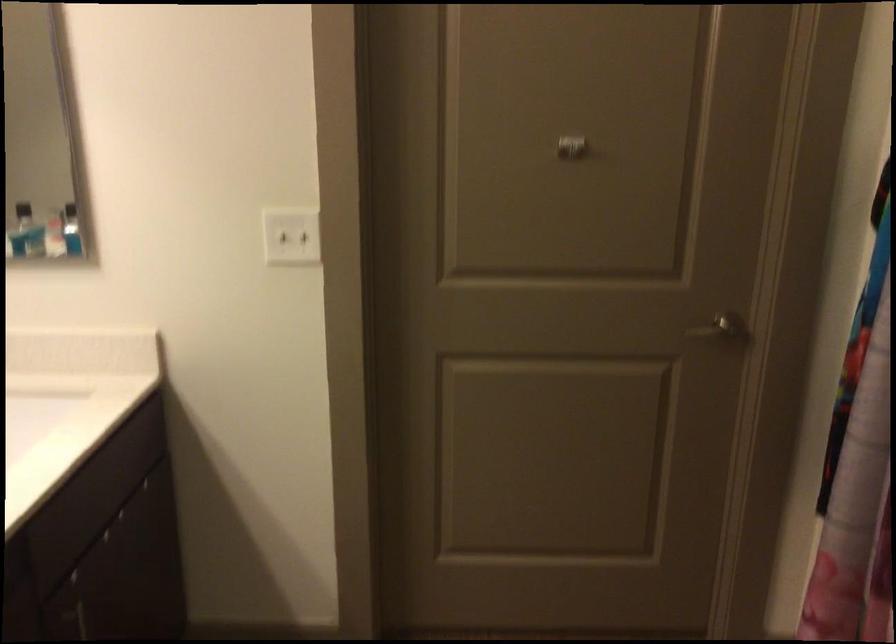
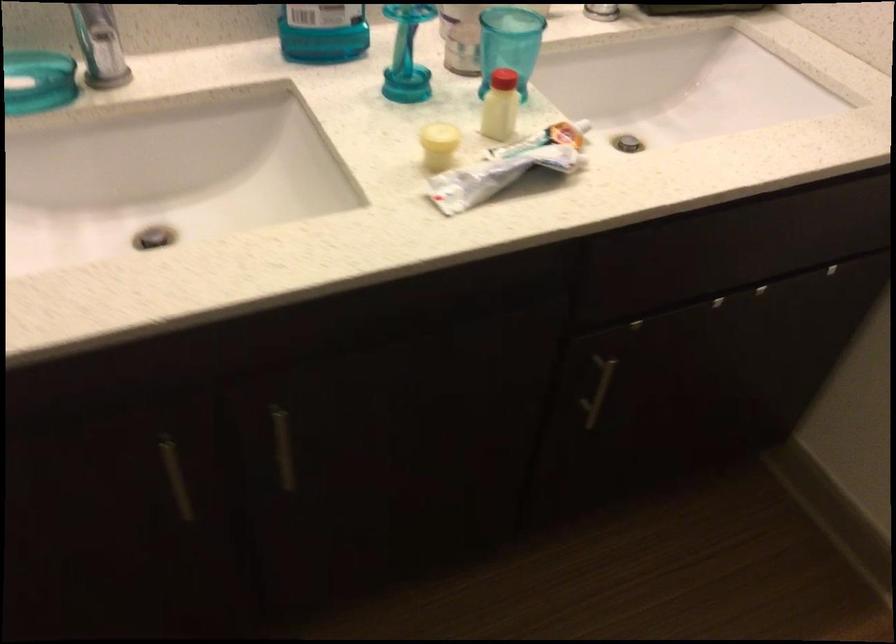
Based on the continuous images, in which direction is the camera rotating?

The rotation direction of the camera is left-down.